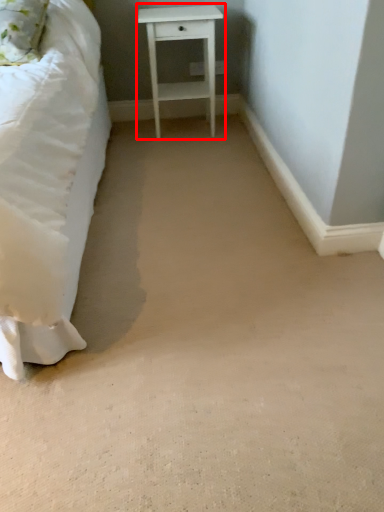
Question: Where is nightstand (annotated by the red box) located in relation to pillow in the image?

Choices:
 (A) right
 (B) left

Answer: (A)